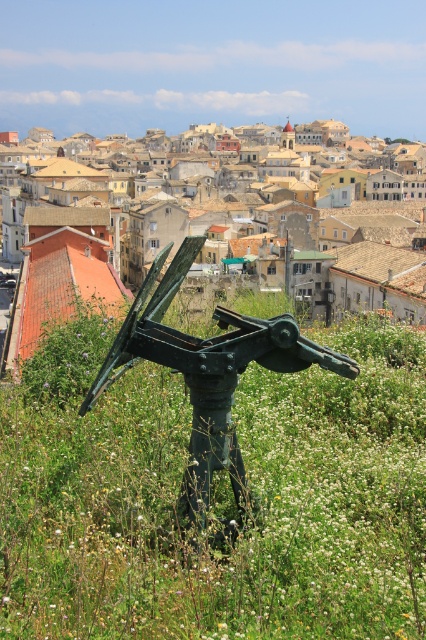
You are standing in the field and see the green grassy at center and the green metal sculpture at center. Which one is located to the right of the other?

The green grassy at center is to the right of the green metal sculpture at center.

You are standing in the field and want to reach the green metal sculpture at center. Which direction should you move relative to the green grassy at center?

The green grassy at center is below the green metal sculpture at center, so you should move upward from the green grassy at center to reach the green metal sculpture at center.

You are a gardener who needs to water the green grassy at center using the green metal sculpture at center. The water hose you have can only reach 20 feet. Can you water the grass without moving the hose? Please explain.

The distance between the green grassy at center and the green metal sculpture at center is 21.48 feet. Since the hose can only reach 20 feet, you cannot water the grass without moving the hose closer.